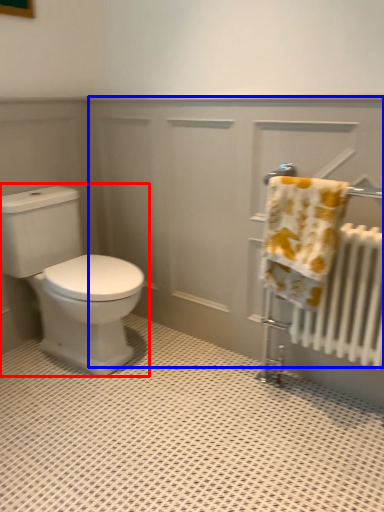
Question: Which point is closer to the camera, toilet (highlighted by a red box) or screen door (highlighted by a blue box)?

Choices:
 (A) toilet
 (B) screen door

Answer: (B)